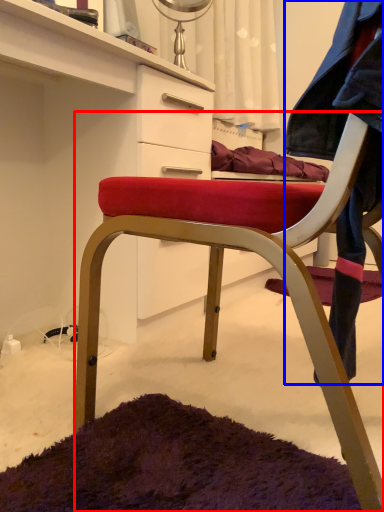
Question: Which point is further to the camera, chair (highlighted by a red box) or denim jacket (highlighted by a blue box)?

Choices:
 (A) chair
 (B) denim jacket

Answer: (A)